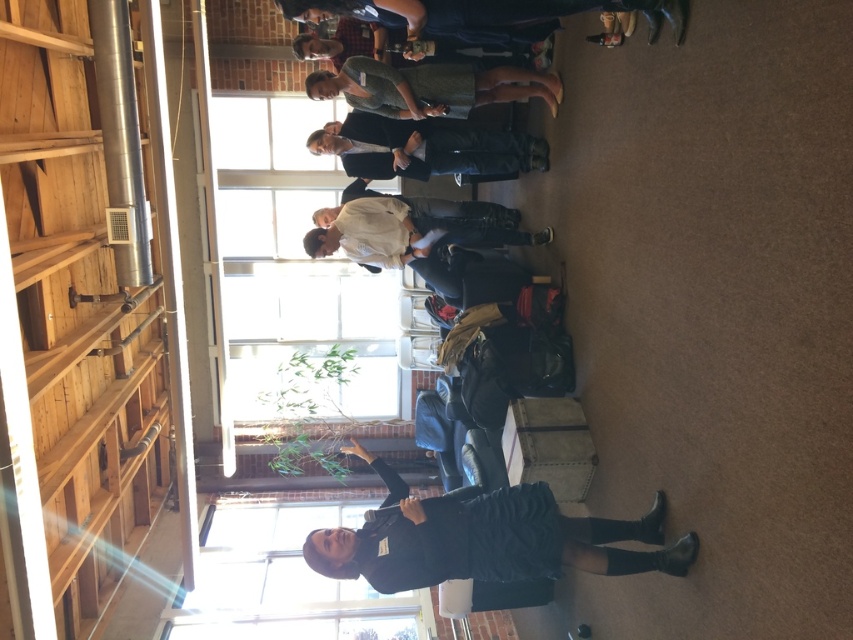
You are attending a meeting in this office space and notice two people dressed in white cotton shirt at center and green textured dress at upper center. Which individual is positioned closer to the front of the room?

The white cotton shirt at center is closer to the front of the room because the green textured dress at upper center is positioned behind it.

You are attending a meeting in the office and need to find a seat. You see a white cotton shirt at center and a green textured dress at upper center. Which person is standing closer to the front of the room?

The white cotton shirt at center is much taller than the green textured dress at upper center, so the white cotton shirt at center is standing closer to the front of the room.